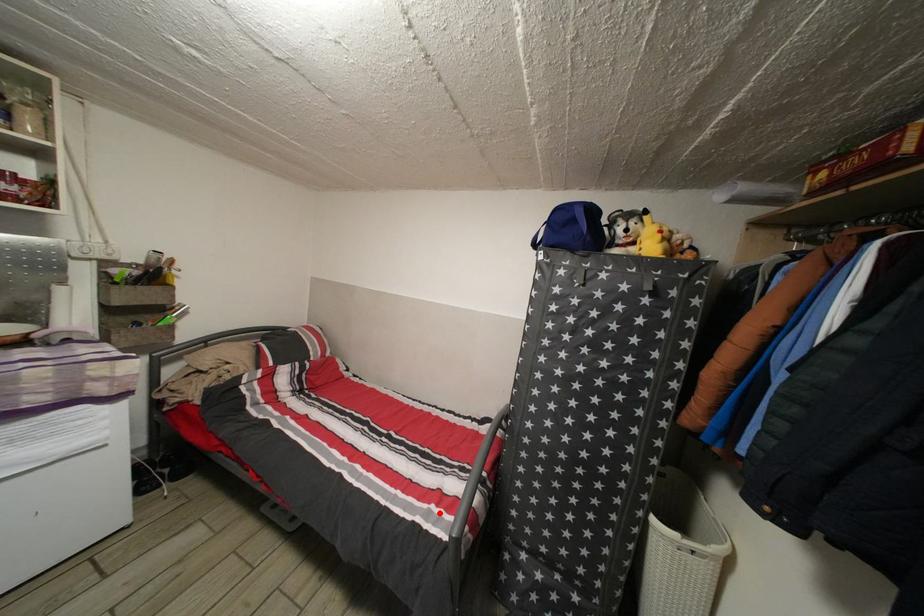
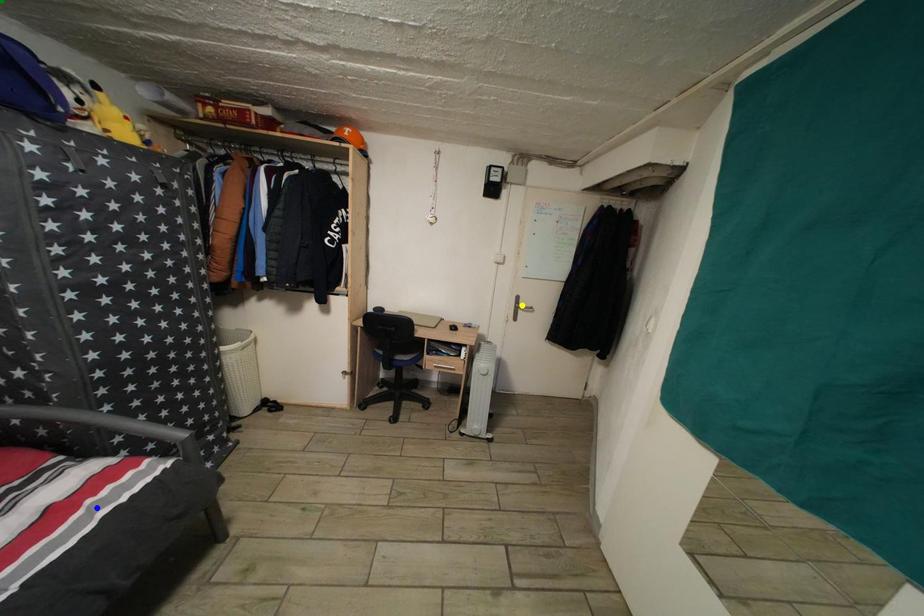
Question: I am providing you with two images of the same scene from different viewpoints. A red point is marked on the first image. You are given multiple points on the second image. Which mark in image 2 goes with the point in image 1?

Choices:
 (A) yellow point
 (B) blue point
 (C) green point

Answer: (B)